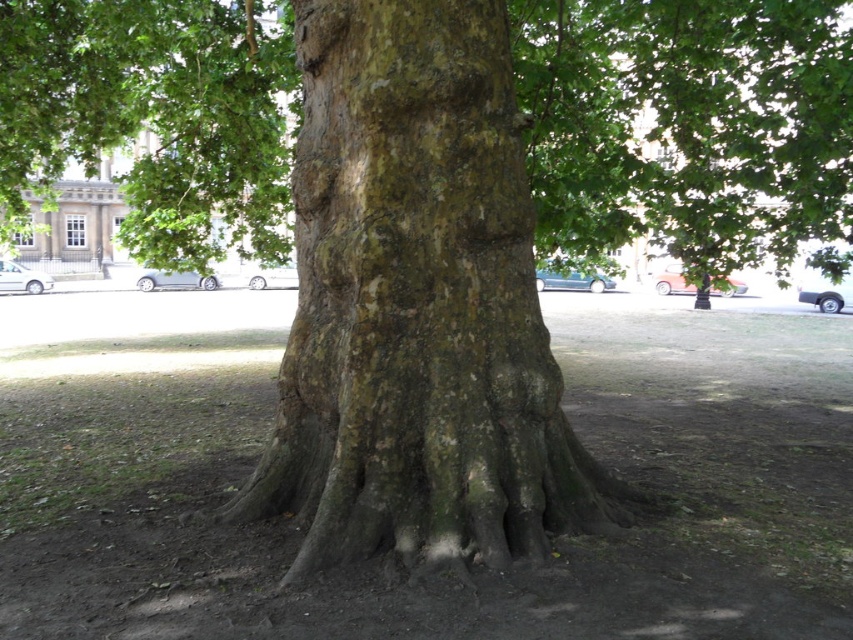
Question: Does green mossy bark at center have a larger size compared to smooth bark tree at center?

Choices:
 (A) no
 (B) yes

Answer: (A)

Question: Which object appears closest to the camera in this image?

Choices:
 (A) smooth bark tree at center
 (B) green mossy bark at center

Answer: (B)

Question: Which of the following is the closest to the observer?

Choices:
 (A) smooth bark tree at center
 (B) green mossy bark at center

Answer: (B)

Question: Where is green mossy bark at center located in relation to smooth bark tree at center in the image?

Choices:
 (A) left
 (B) right

Answer: (B)

Question: Is green mossy bark at center to the right of smooth bark tree at center from the viewer's perspective?

Choices:
 (A) yes
 (B) no

Answer: (A)